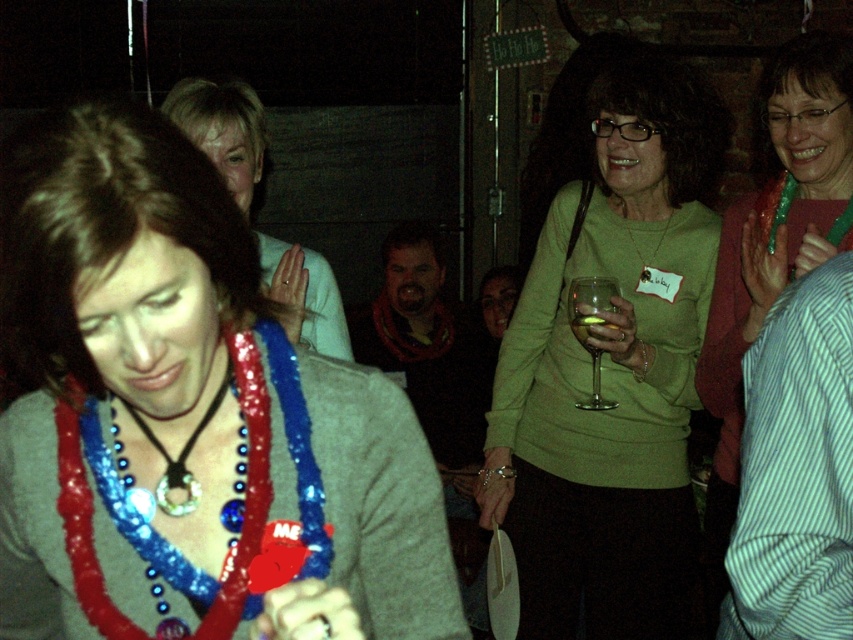
Which is more to the right, shiny plastic necklace at center or blue beaded necklace at center?

From the viewer's perspective, blue beaded necklace at center appears more on the right side.

Looking at this image, between shiny plastic necklace at center and blue beaded necklace at center, which one is positioned higher?

shiny plastic necklace at center

Between point (285, 300) and point (198, 429), which one is positioned behind?

The point (285, 300) is more distant.

Find the location of a particular element. Image resolution: width=853 pixels, height=640 pixels. shiny plastic necklace at center is located at coordinates (222, 129).

Between clear glass wine glass at center and blue beaded necklace at center, which one appears on the left side from the viewer's perspective?

From the viewer's perspective, blue beaded necklace at center appears more on the left side.

The height and width of the screenshot is (640, 853). Identify the location of clear glass wine glass at center. (590, 324).

Locate an element on the screen. The height and width of the screenshot is (640, 853). clear glass wine glass at center is located at coordinates (590, 324).

Between green shiny necklace at upper right and silver metallic tag at upper center, which one appears on the right side from the viewer's perspective?

green shiny necklace at upper right is more to the right.

Can you confirm if green shiny necklace at upper right is taller than silver metallic tag at upper center?

Correct, green shiny necklace at upper right is much taller as silver metallic tag at upper center.

The image size is (853, 640). What do you see at coordinates (773, 246) in the screenshot?
I see `green shiny necklace at upper right` at bounding box center [773, 246].

Identify the location of green shiny necklace at upper right. This screenshot has width=853, height=640. (773, 246).